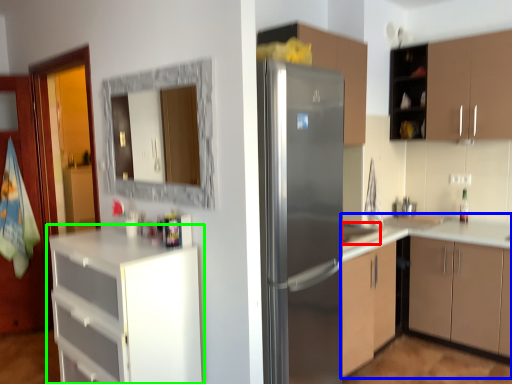
Question: Which object is positioned farthest from sink (highlighted by a red box)? Select from cabinetry (highlighted by a blue box) and cabinetry (highlighted by a green box).

Choices:
 (A) cabinetry
 (B) cabinetry

Answer: (B)